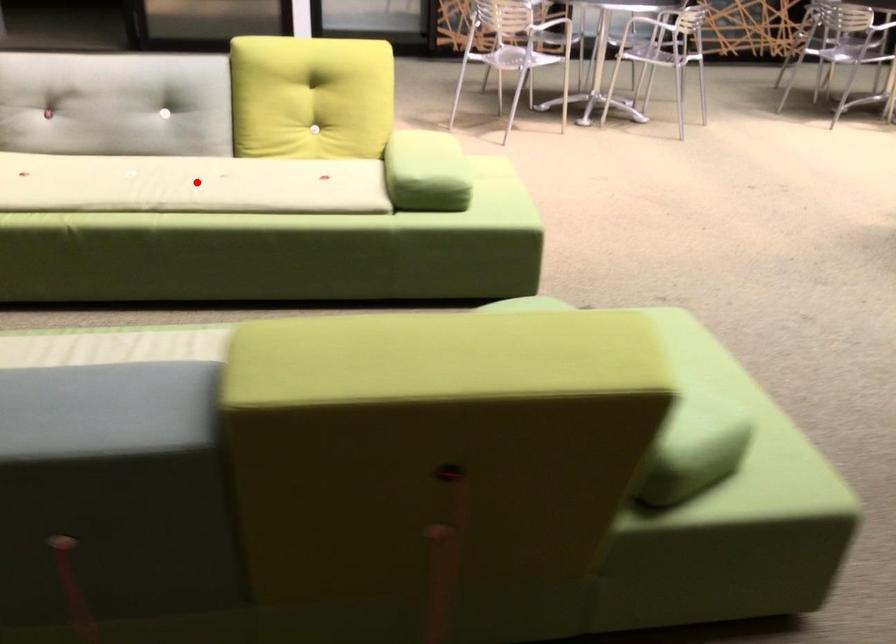
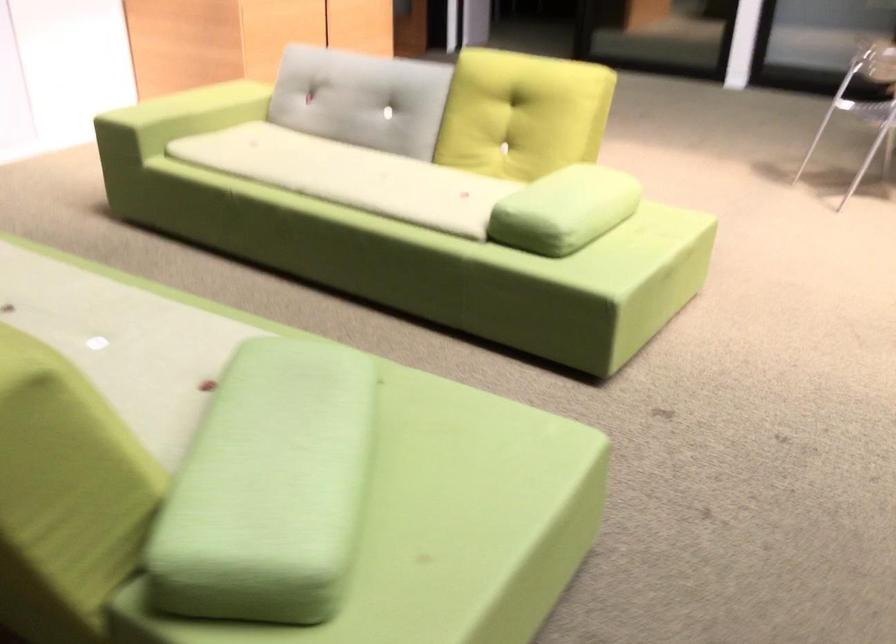
Find the pixel in the second image that matches the highlighted location in the first image.

(349, 176)